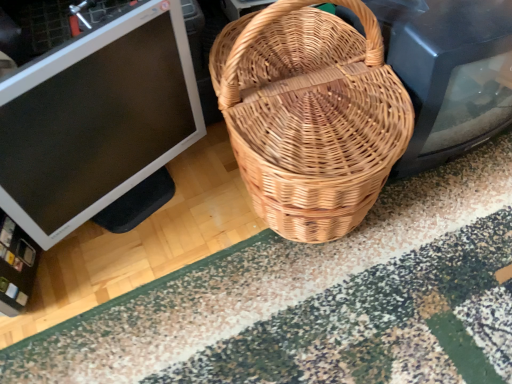
The image size is (512, 384). I want to click on free space in front of natural woven picnic basket at center, so click(x=314, y=314).